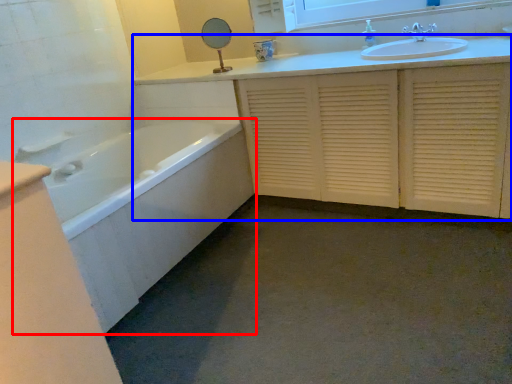
Question: Which object appears farthest to the camera in this image, bathtub (highlighted by a red box) or bathroom cabinet (highlighted by a blue box)?

Choices:
 (A) bathtub
 (B) bathroom cabinet

Answer: (B)